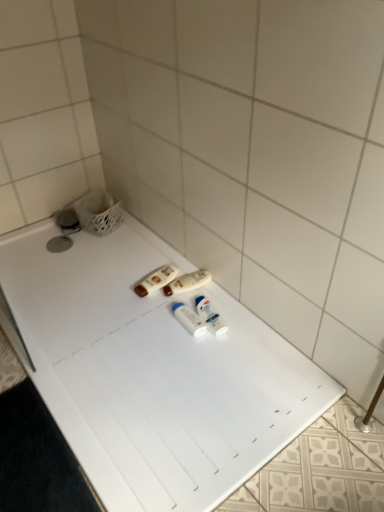
Question: From the image's perspective, is white plastic bottles at center, acting as the second toiletry starting from the right, beneath white plastic bottles at center, which is the third toiletry in right-to-left order?

Choices:
 (A) yes
 (B) no

Answer: (A)

Question: Does white plastic bottles at center, acting as the second toiletry starting from the right, touch white plastic bottles at center, which is the third toiletry in right-to-left order?

Choices:
 (A) no
 (B) yes

Answer: (A)

Question: Can you confirm if white plastic bottles at center, the 3th toiletry when ordered from left to right, is wider than white plastic bottles at center, the second toiletry positioned from the left?

Choices:
 (A) yes
 (B) no

Answer: (B)

Question: Is white plastic bottles at center, the 3th toiletry when ordered from left to right, far away from white plastic bottles at center, which is the third toiletry in right-to-left order?

Choices:
 (A) no
 (B) yes

Answer: (A)

Question: From a real-world perspective, is white plastic bottles at center, the 3th toiletry when ordered from left to right, on top of white plastic bottles at center, the second toiletry positioned from the left?

Choices:
 (A) no
 (B) yes

Answer: (B)

Question: In terms of height, does white plastic bathtub at center look taller or shorter compared to brown plastic lotion at center, positioned as the 4th toiletry in right-to-left order?

Choices:
 (A) short
 (B) tall

Answer: (A)

Question: Considering the positions of white plastic bathtub at center and brown plastic lotion at center, the first toiletry in the left-to-right sequence, in the image, is white plastic bathtub at center wider or thinner than brown plastic lotion at center, the first toiletry in the left-to-right sequence,?

Choices:
 (A) wide
 (B) thin

Answer: (A)

Question: Considering the positions of point (182, 386) and point (155, 268), is point (182, 386) closer or farther from the camera than point (155, 268)?

Choices:
 (A) closer
 (B) farther

Answer: (A)

Question: From the image's perspective, is white plastic bathtub at center positioned above or below brown plastic lotion at center, positioned as the 4th toiletry in right-to-left order?

Choices:
 (A) below
 (B) above

Answer: (A)

Question: Looking at their shapes, would you say white plastic deodorant at center, acting as the first toiletry starting from the right, is wider or thinner than brown plastic lotion at center, the first toiletry in the left-to-right sequence?

Choices:
 (A) wide
 (B) thin

Answer: (B)

Question: Does point (208, 305) appear closer or farther from the camera than point (142, 287)?

Choices:
 (A) closer
 (B) farther

Answer: (A)

Question: Considering the positions of white plastic deodorant at center, marked as the fourth toiletry in a left-to-right arrangement, and brown plastic lotion at center, the first toiletry in the left-to-right sequence, in the image, is white plastic deodorant at center, marked as the fourth toiletry in a left-to-right arrangement, bigger or smaller than brown plastic lotion at center, the first toiletry in the left-to-right sequence,?

Choices:
 (A) small
 (B) big

Answer: (A)

Question: In the image, is white plastic deodorant at center, marked as the fourth toiletry in a left-to-right arrangement, positioned in front of or behind brown plastic lotion at center, the first toiletry in the left-to-right sequence?

Choices:
 (A) behind
 (B) front

Answer: (B)

Question: From the image's perspective, is white plastic bottles at center, the second toiletry positioned from the left, located above or below white plastic bathtub at center?

Choices:
 (A) below
 (B) above

Answer: (B)

Question: Would you say white plastic bottles at center, the second toiletry positioned from the left, is to the left or to the right of white plastic bathtub at center in the picture?

Choices:
 (A) left
 (B) right

Answer: (B)